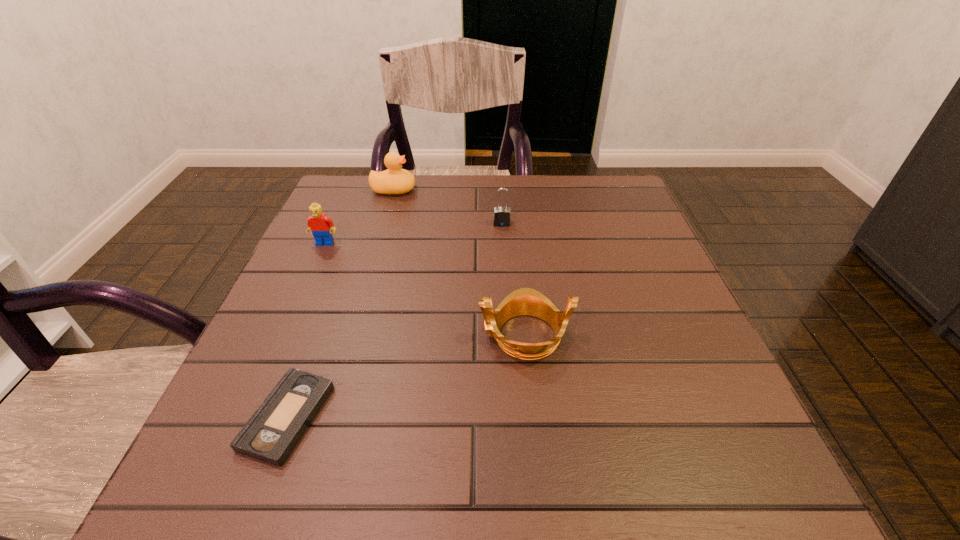
The width and height of the screenshot is (960, 540). In order to click on object located in the near left corner section of the desktop in this screenshot , I will do `click(270, 435)`.

Locate an element on the screen. free space at the far edge is located at coordinates (480, 181).

Locate an element on the screen. vacant space at the near edge of the desktop is located at coordinates (350, 477).

This screenshot has height=540, width=960. What are the coordinates of `blank space at the left edge of the desktop` in the screenshot? It's located at (331, 258).

Locate an element on the screen. The height and width of the screenshot is (540, 960). blank space at the right edge is located at coordinates (625, 278).

The height and width of the screenshot is (540, 960). What are the coordinates of `vacant space at the far right corner of the desktop` in the screenshot? It's located at (605, 207).

In the image, there is a desktop. Where is `vacant region at the near right corner`? This screenshot has width=960, height=540. vacant region at the near right corner is located at coordinates (698, 505).

Identify the location of empty location between the fourth farthest object and the farthest object. (459, 262).

Image resolution: width=960 pixels, height=540 pixels. What are the coordinates of `unoccupied area between the duck and the fourth nearest object` in the screenshot? It's located at (447, 207).

Identify the location of vacant area between the duck and the third farthest object. The image size is (960, 540). (359, 217).